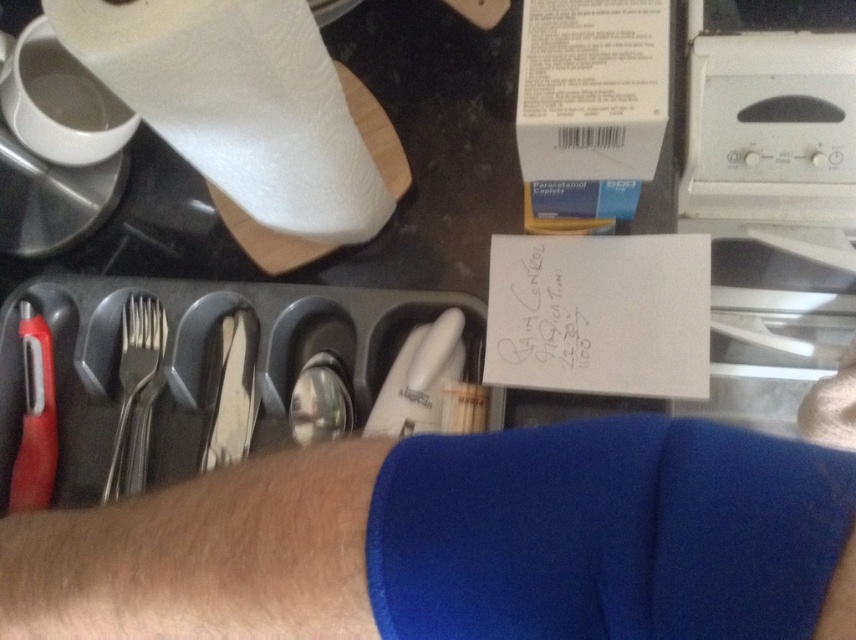
Does white paper towel at upper left appear on the right side of satin silverware at center?

Indeed, white paper towel at upper left is positioned on the right side of satin silverware at center.

Who is positioned more to the right, white paper towel at upper left or satin silverware at center?

Positioned to the right is white paper towel at upper left.

Does point (296, 1) come behind point (217, 429)?

No.

Find the location of a particular element. white paper towel at upper left is located at coordinates (238, 104).

At what (x,y) coordinates should I click in order to perform the action: click on white paper towel at upper left. Please return your answer as a coordinate pair (x, y). Looking at the image, I should click on (238, 104).

Looking at this image, is white paper towel at upper left shorter than red plastic knife at left?

Yes.

Measure the distance between point (x=325, y=120) and camera.

A distance of 21.74 inches exists between point (x=325, y=120) and camera.

Locate an element on the screen. The image size is (856, 640). white paper towel at upper left is located at coordinates [238, 104].

Based on the photo, is satin silver fork at left to the right of satin silverware at center from the viewer's perspective?

Incorrect, satin silver fork at left is not on the right side of satin silverware at center.

Is point (123, 301) positioned behind point (218, 404)?

Yes, it is.

Locate an element on the screen. This screenshot has width=856, height=640. satin silver fork at left is located at coordinates (135, 394).